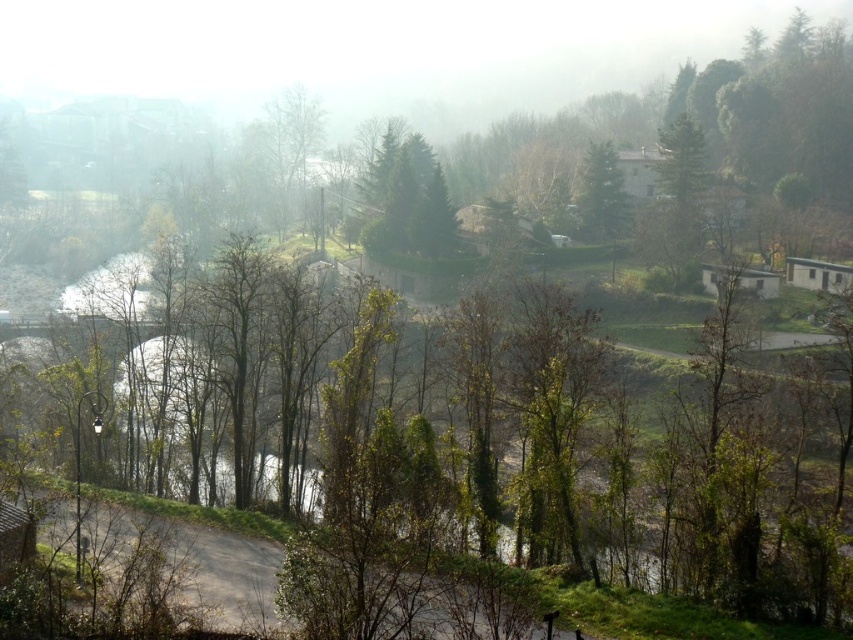
You are standing at the center of the image. Which direction should you look to see the green textured tree at center?

The green textured tree at center is located at point coordinates of (408, 198), so you should look towards the center of the image to see it.

You are a hiker standing on the metal bridge and want to know which tree has a wider spread of branches between the green textured tree at center and the green matte tree at upper center?

The green textured tree at center has a wider spread of branches than the green matte tree at upper center because its width is larger.

You are a hiker standing on the metal bridge in the middle of the image. You notice two trees in the scene. Which tree, the green textured tree at center or the green matte tree at upper center, is positioned higher up in the image?

The green textured tree at center is positioned higher up in the image than the green matte tree at upper center.